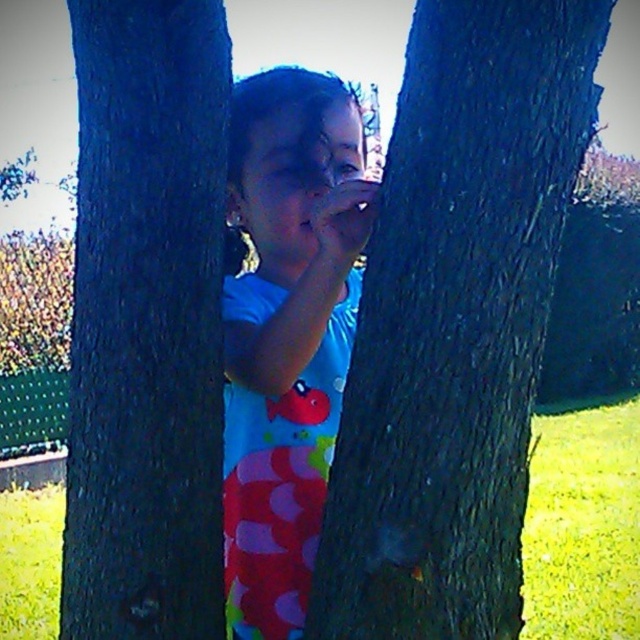
You are a photographer standing at the camera position. You want to take a photo of the smooth bark tree trunk at center. If your camera can focus on objects within 30 inches, will you need to move closer or farther away to capture a clear image?

The smooth bark tree trunk at center is currently 35.44 inches away from the camera. Since your camera can focus on objects within 30 inches, you need to move closer to reduce the distance to within the focus range.

You are a painter standing in the park and want to paint the scene where the child is hiding. You have a canvas that can only accommodate objects up to 1 meter wide. The dark brown rough tree trunk at center and the blue fabric at center are both in your view. Based on their widths, can both fit side by side on your canvas?

The dark brown rough tree trunk at center has a lesser width compared to blue fabric at center. However, without knowing the exact widths of both objects, it is impossible to determine if they can fit side by side on the canvas. Additional information about their individual widths is required to make this assessment.

You are a parent trying to locate your child who is hiding behind two tree trunks in the park. The child is partially hidden by the smooth bark tree trunk at center and the dark brown rough tree trunk at center. Which tree trunk is on the left side when facing the child?

The dark brown rough tree trunk at center is on the left side of the smooth bark tree trunk at center, so when facing the child, the dark brown rough tree trunk at center would be on the left.